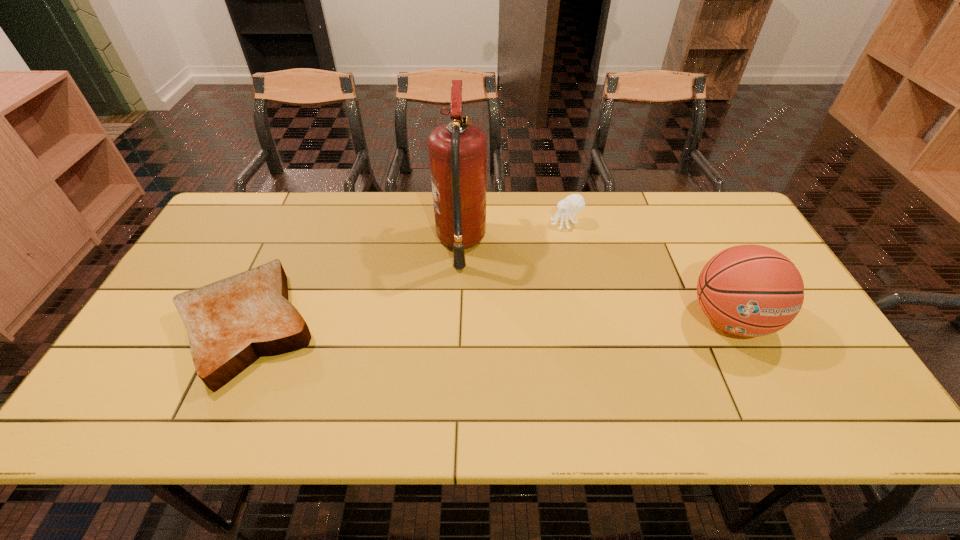
This screenshot has width=960, height=540. Identify the location of the tallest object. (458, 150).

Where is `the third object from right to left`? The height and width of the screenshot is (540, 960). the third object from right to left is located at coordinates coord(458,150).

At what (x,y) coordinates should I click in order to perform the action: click on basketball. Please return your answer as a coordinate pair (x, y). This screenshot has width=960, height=540. Looking at the image, I should click on (748, 290).

This screenshot has width=960, height=540. Find the location of `the rightmost object`. the rightmost object is located at coordinates (748, 290).

Locate an element on the screen. This screenshot has width=960, height=540. the third object from left to right is located at coordinates (574, 203).

Locate an element on the screen. The height and width of the screenshot is (540, 960). the second shortest object is located at coordinates point(574,203).

Locate an element on the screen. The width and height of the screenshot is (960, 540). the leftmost object is located at coordinates (231, 323).

At what (x,y) coordinates should I click in order to perform the action: click on bread. Please return your answer as a coordinate pair (x, y). The width and height of the screenshot is (960, 540). Looking at the image, I should click on (231, 323).

Where is `vacant region located at the front of the third object from right to left where the nozzle is aimed`? This screenshot has width=960, height=540. vacant region located at the front of the third object from right to left where the nozzle is aimed is located at coordinates (541, 242).

Identify the location of vacant space located 0.070m on the logo side of the third shortest object. (760, 381).